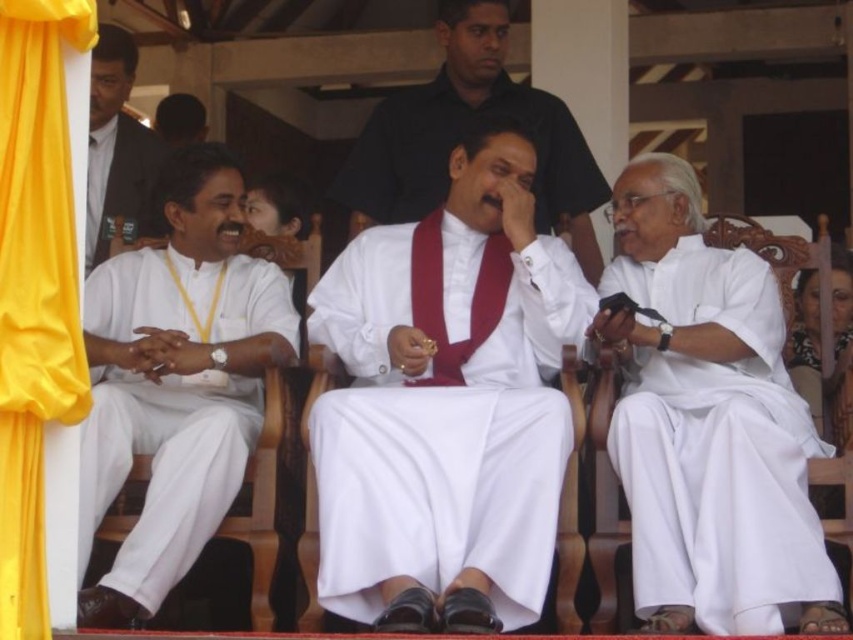
Question: Which point appears closest to the camera in this image?

Choices:
 (A) (x=12, y=259)
 (B) (x=556, y=196)
 (C) (x=108, y=192)

Answer: (A)

Question: Which point appears farthest from the camera in this image?

Choices:
 (A) (128, 337)
 (B) (331, 444)
 (C) (109, 163)

Answer: (C)

Question: Is the position of white silk robe at center more distant than that of white cotton kurta at right?

Choices:
 (A) no
 (B) yes

Answer: (B)

Question: Does white silk robe at center have a lesser width compared to yellow fabric curtain at left?

Choices:
 (A) no
 (B) yes

Answer: (A)

Question: From the image, what is the correct spatial relationship of white cotton shirt at left in relation to white fabric suit at left?

Choices:
 (A) above
 (B) below

Answer: (B)

Question: Which object is closer to the camera taking this photo?

Choices:
 (A) white cotton shirt at left
 (B) yellow fabric curtain at left

Answer: (B)